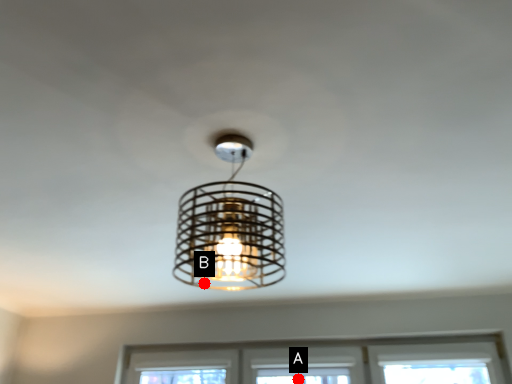
Question: Two points are circled on the image, labeled by A and B beside each circle. Which point is farther from the camera taking this photo?

Choices:
 (A) A is further
 (B) B is further

Answer: (A)